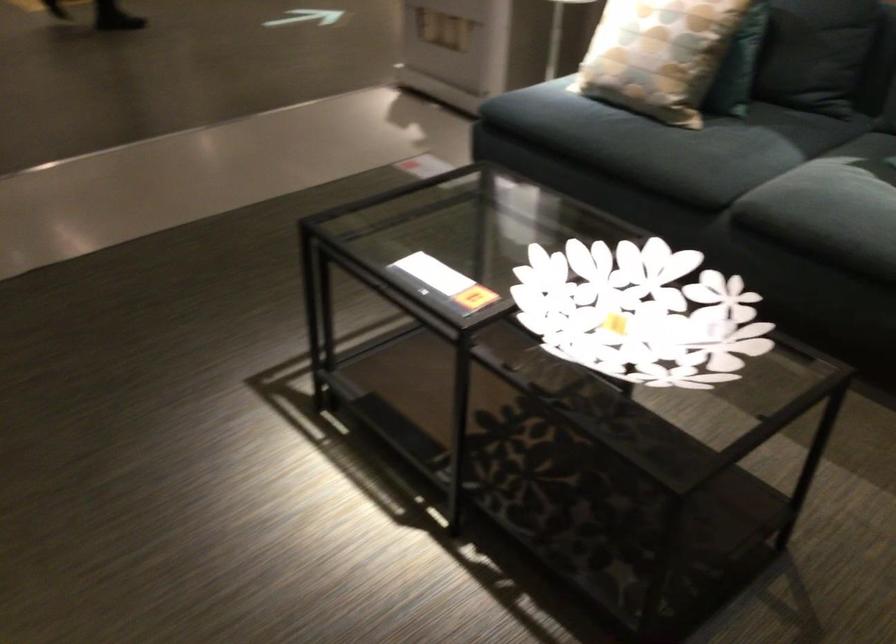
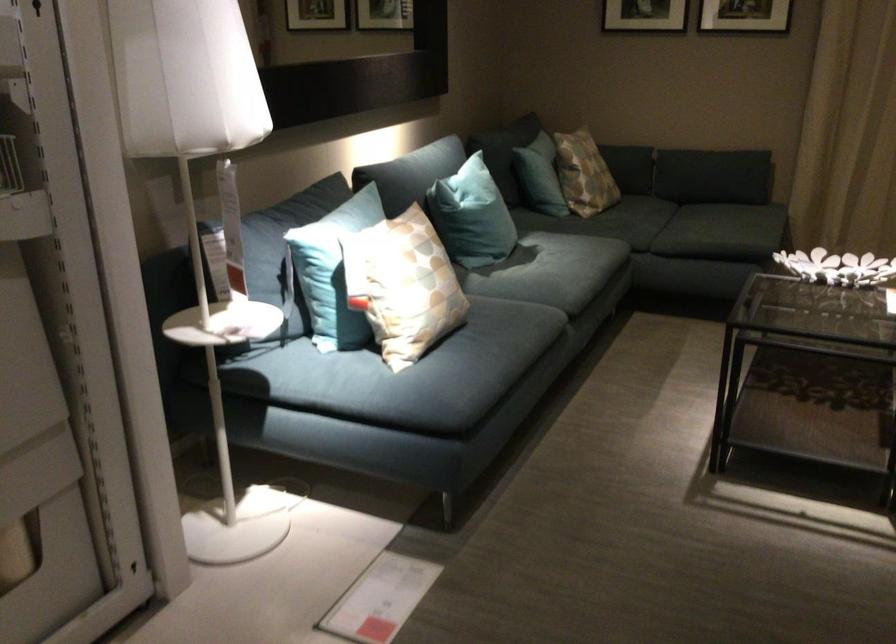
Find the pixel in the second image that matches pixel 808 181 in the first image.

(552, 275)